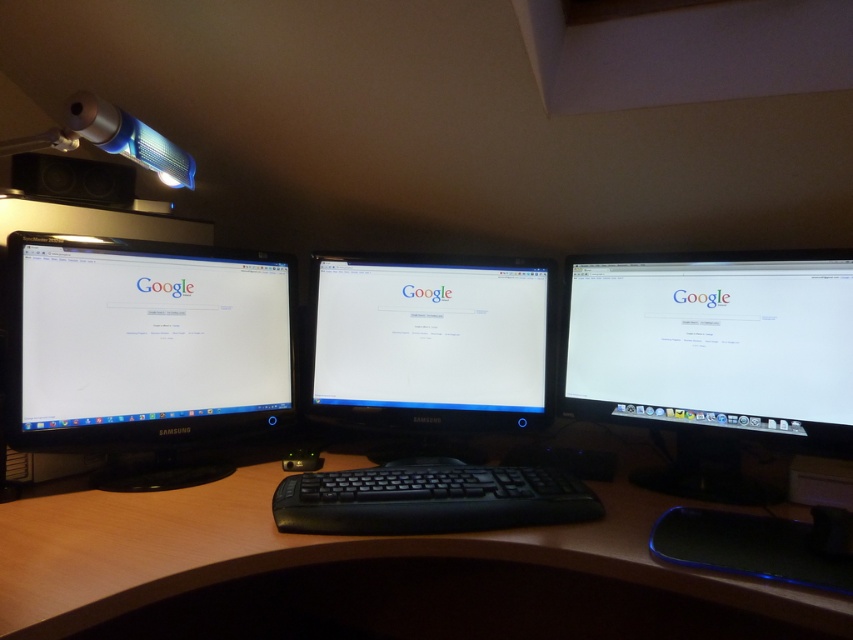
You need to place a mouse on the desk between the white glossy monitor at right and the black matte keyboard at center. Based on their positions, where should you place the mouse so it is closer to the keyboard than the monitor?

The mouse should be placed closer to the black matte keyboard at center than the white glossy monitor at right. Since the white glossy monitor at right is to the right of the black matte keyboard at center, placing the mouse to the left of the monitor but still between them ensures it is nearer to the keyboard.

You are a remote worker who needs to access an important file on the white glossy monitor at right. From your current position, which direction should you move to reach it?

The white glossy monitor at right is located at point (712, 342), so you should move towards the right side of the desk to reach it.